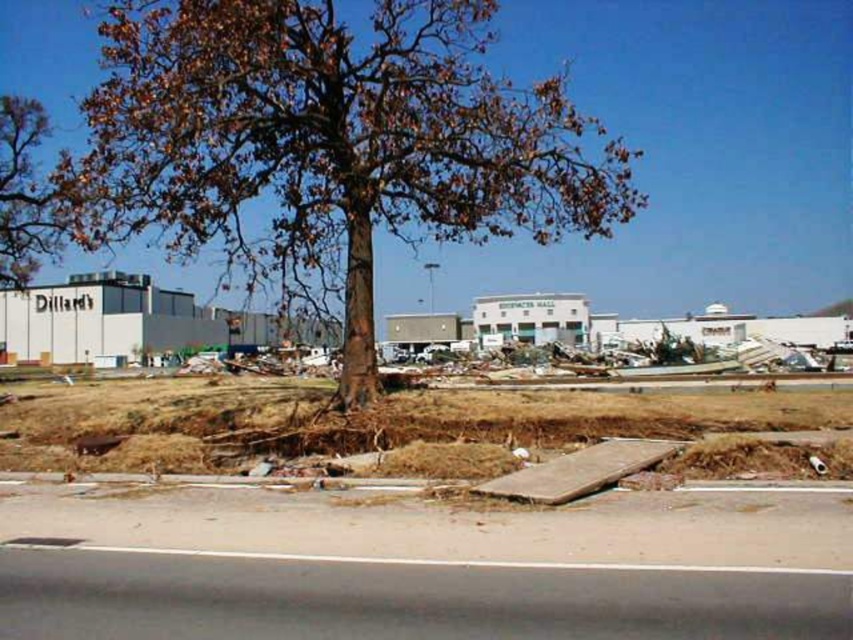
Question: Does brown rough bark tree at center come behind brown leafy tree at upper left?

Choices:
 (A) no
 (B) yes

Answer: (A)

Question: Among these objects, which one is nearest to the camera?

Choices:
 (A) brown rough bark tree at center
 (B) brown leafy tree at upper left

Answer: (A)

Question: Which object is closer to the camera taking this photo?

Choices:
 (A) brown rough bark tree at center
 (B) brown leafy tree at upper left

Answer: (A)

Question: Is brown rough bark tree at center above brown leafy tree at upper left?

Choices:
 (A) yes
 (B) no

Answer: (B)

Question: Is brown rough bark tree at center thinner than brown leafy tree at upper left?

Choices:
 (A) no
 (B) yes

Answer: (A)